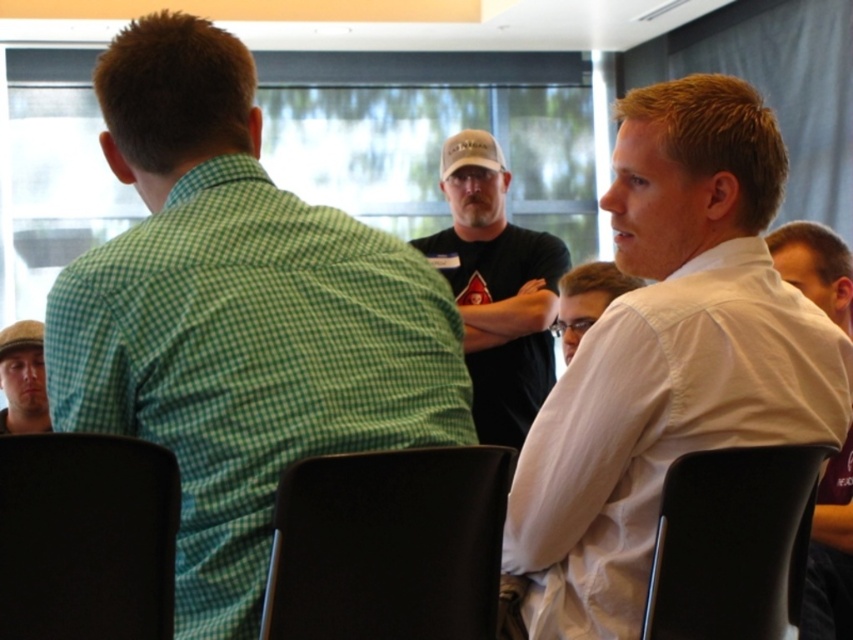
Which is below, black plastic chair at lower left or black plastic chair at lower right?

Positioned lower is black plastic chair at lower right.

Can you confirm if black plastic chair at lower left is smaller than black plastic chair at lower right?

Yes.

The height and width of the screenshot is (640, 853). I want to click on black plastic chair at lower left, so click(x=86, y=538).

Is black plastic chair at lower left shorter than white shirt at right?

Yes, black plastic chair at lower left is shorter than white shirt at right.

Who is positioned more to the right, black plastic chair at lower left or white shirt at right?

From the viewer's perspective, white shirt at right appears more on the right side.

Is point (177, 506) more distant than point (820, 532)?

No, it is not.

The image size is (853, 640). I want to click on black plastic chair at lower left, so click(x=86, y=538).

Who is higher up, dark gray cap at center or white shirt at right?

dark gray cap at center

Identify the location of dark gray cap at center. (496, 289).

Where is `dark gray cap at center`? The image size is (853, 640). dark gray cap at center is located at coordinates (496, 289).